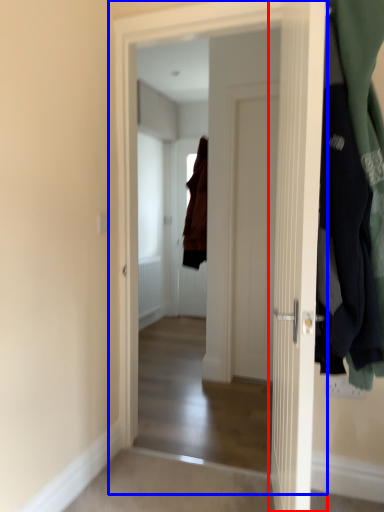
Question: Which object appears farthest to the camera in this image, door (highlighted by a red box) or door (highlighted by a blue box)?

Choices:
 (A) door
 (B) door

Answer: (B)